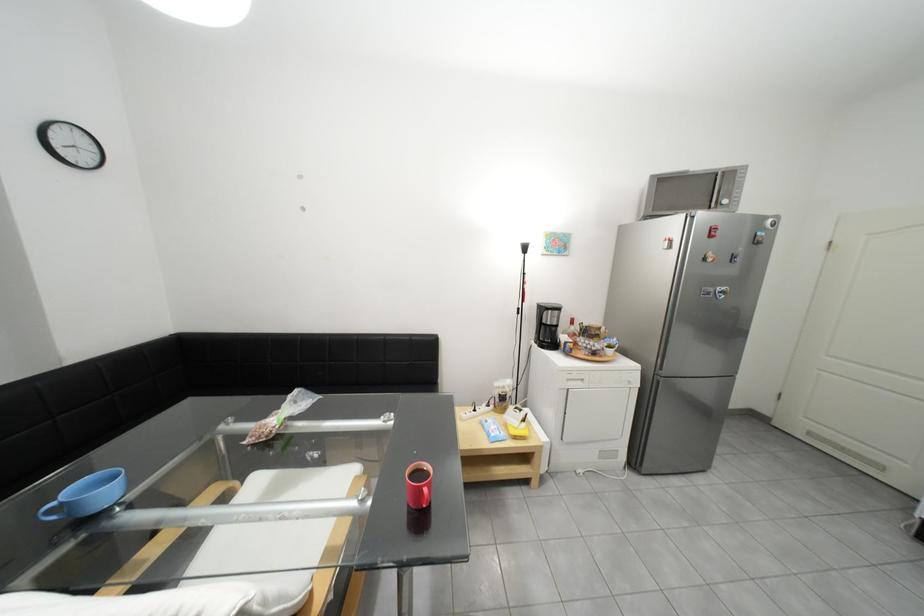
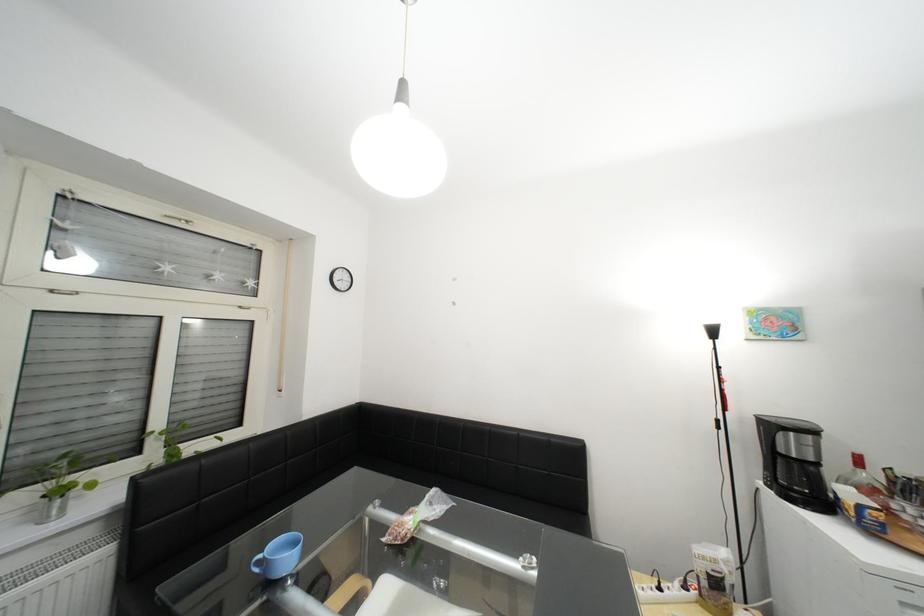
The point at (553, 310) is marked in the first image. Where is the corresponding point in the second image?

(782, 428)